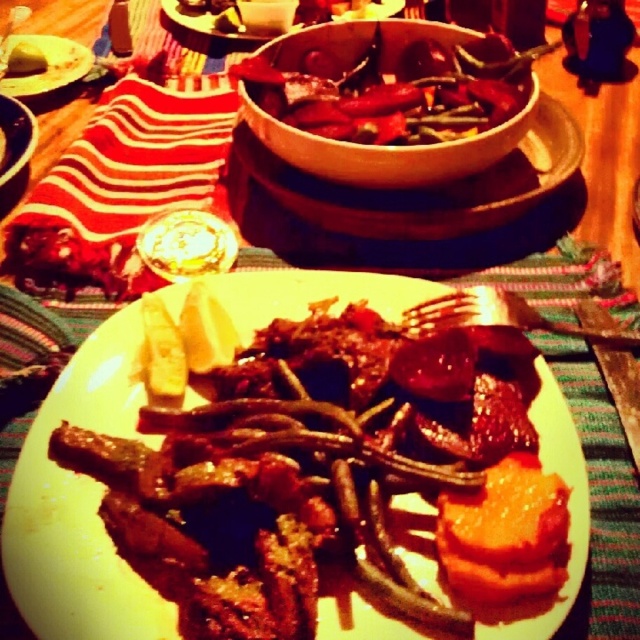
How far apart are matte white plate at upper left and matte brown bowl at upper center?

The distance of matte white plate at upper left from matte brown bowl at upper center is 15.74 centimeters.

Can you confirm if matte white plate at upper left is thinner than matte brown bowl at upper center?

Yes.

Where is `matte white plate at upper left`? matte white plate at upper left is located at coordinates (42, 65).

Can you confirm if savory brown meat at center is bigger than green matte carrot at center?

Yes.

In the scene shown: Can you confirm if savory brown meat at center is positioned to the right of green matte carrot at center?

Yes, savory brown meat at center is to the right of green matte carrot at center.

Which is behind, point (326, 621) or point (10, 58)?

Positioned behind is point (10, 58).

Identify the location of savory brown meat at center. (310, 292).

Can you confirm if matte white plate at upper left is thinner than green matte carrot at center?

Incorrect, matte white plate at upper left's width is not less than green matte carrot at center's.

Can you confirm if matte white plate at upper left is positioned below green matte carrot at center?

Actually, matte white plate at upper left is above green matte carrot at center.

Is point (20, 77) more distant than point (22, 45)?

No.

What are the coordinates of `matte white plate at upper left` in the screenshot? It's located at (42, 65).